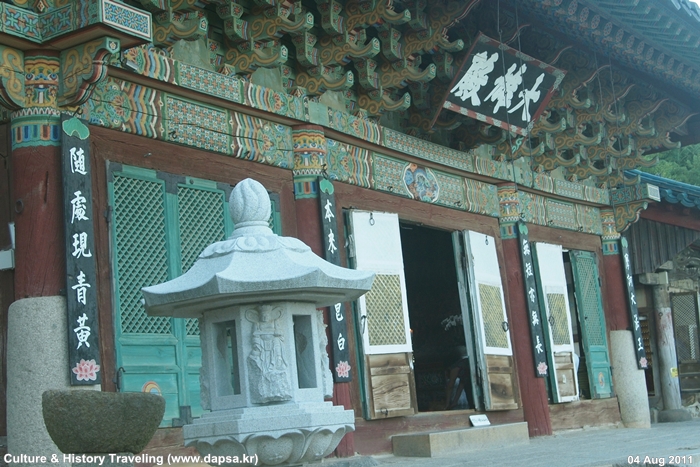
The width and height of the screenshot is (700, 467). What are the coordinates of `sign above door` in the screenshot? It's located at (475, 80), (505, 96), (531, 101).